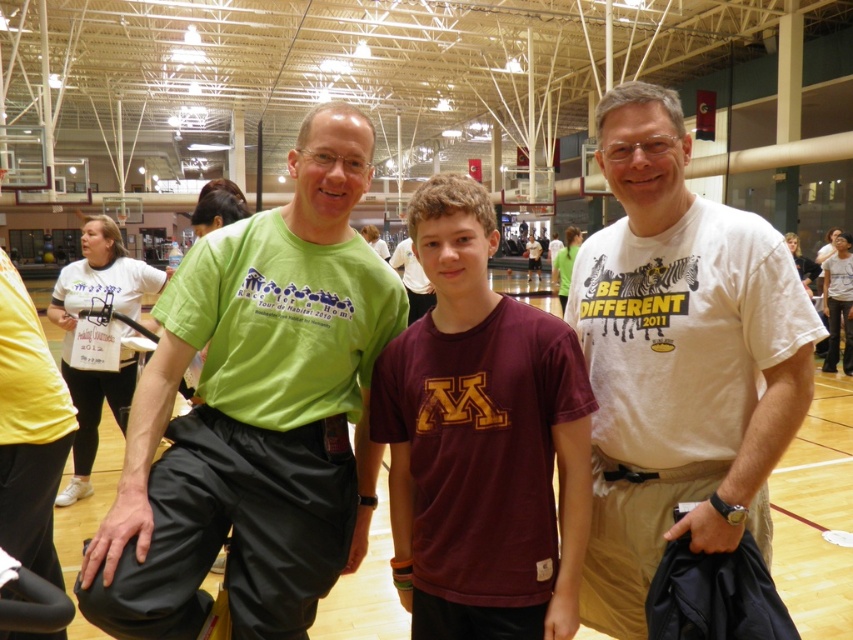
Question: Is green fabric shirt at left further to camera compared to maroon cotton t-shirt at center?

Choices:
 (A) yes
 (B) no

Answer: (B)

Question: Which object is the closest to the maroon cotton t-shirt at center?

Choices:
 (A) green fabric shirt at left
 (B) white cotton t-shirt at center

Answer: (A)

Question: Among these points, which one is farthest from the camera?

Choices:
 (A) (242, 337)
 (B) (641, 406)
 (C) (576, 387)

Answer: (A)

Question: Which of the following is the farthest from the observer?

Choices:
 (A) maroon cotton t-shirt at center
 (B) green fabric shirt at left
 (C) white cotton t-shirt at center

Answer: (A)

Question: Is green fabric shirt at left to the left of white cotton t-shirt at center from the viewer's perspective?

Choices:
 (A) yes
 (B) no

Answer: (A)

Question: Can you confirm if green fabric shirt at left is positioned to the left of white cotton t-shirt at center?

Choices:
 (A) yes
 (B) no

Answer: (A)